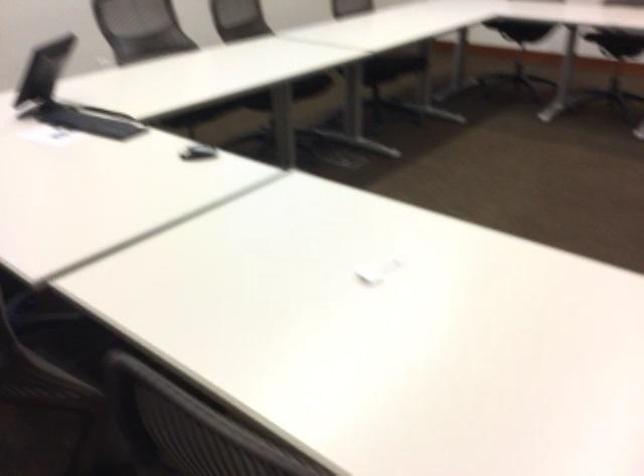
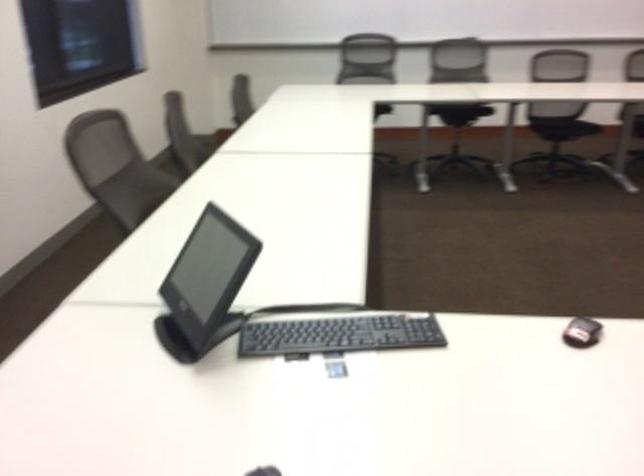
Question: Which direction would the cameraman need to move to produce the second image? Reply with the corresponding letter.

Choices:
 (A) Left
 (B) Right
 (C) Forward
 (D) Backward

Answer: (D)